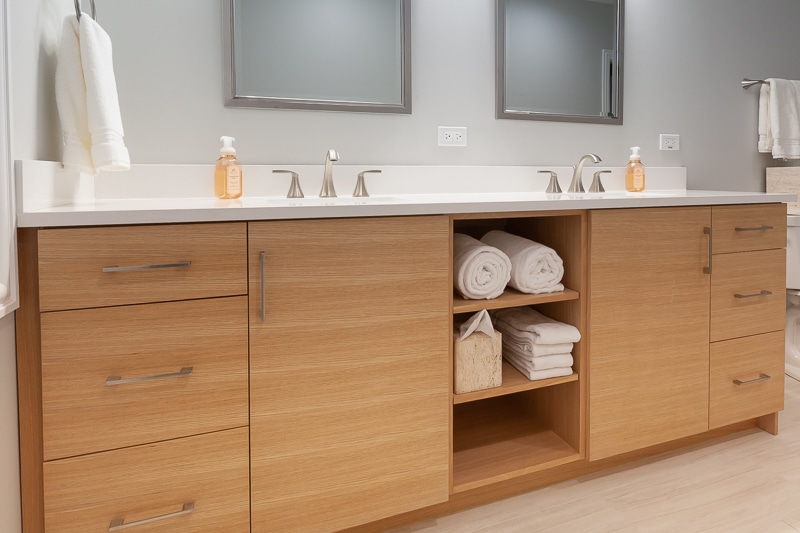
Image resolution: width=800 pixels, height=533 pixels. What are the coordinates of `soap dispenser (right)` in the screenshot? It's located at (634, 169).